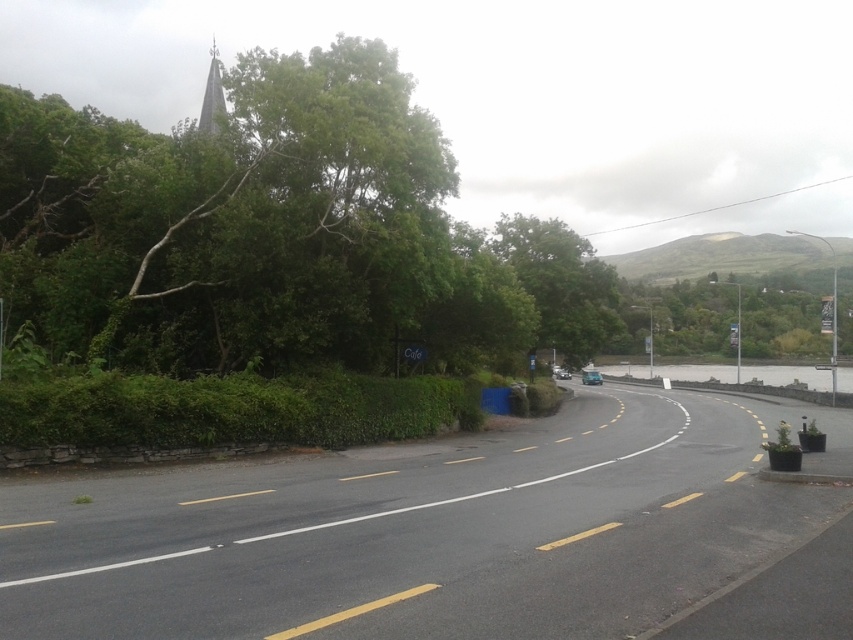
You are a delivery driver navigating a rural road with a truck that has a turning radius of 12 meters. You need to make a sharp right turn at the upcoming curve. The road curves gently to the right, leading towards a body of water. There is a green leafy tree at upper left located at point (277, 230). Can your truck safely navigate the curve without hitting the tree?

The point (277, 230) corresponds to the green leafy tree at upper left. Since the road curves gently to the right and the tree is located at the upper left, it is positioned away from the turning path. Therefore, the truck with a 12 meters turning radius can safely navigate the curve without hitting the tree.

In the scene shown: You are a pedestrian standing on the road and want to reach the green leafy hedge at lower left. Which direction should you walk to avoid the green leafy tree at upper left?

You should walk to the right side of the green leafy tree at upper left to reach the green leafy hedge at lower left since the tree is positioned on the left side of the hedge.

You are a drone operator trying to capture aerial footage of the road. You have two points marked on your screen, point (157, 230) and point (381, 417). Which point should you prioritize if you want to capture the closest part of the road to the camera?

Point (157, 230) is closer to the camera than point (381, 417), so you should prioritize capturing point (157, 230) to get the closest part of the road to the camera.